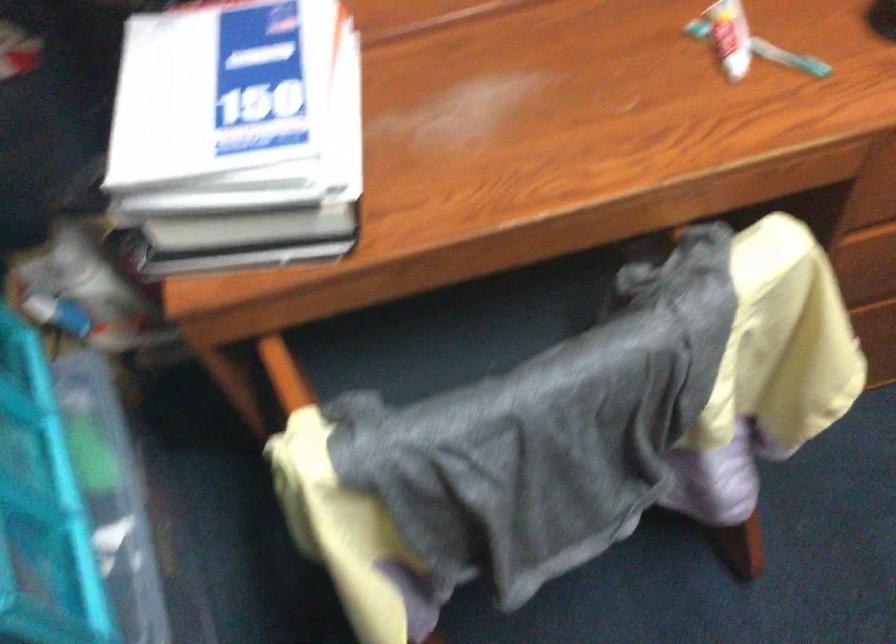
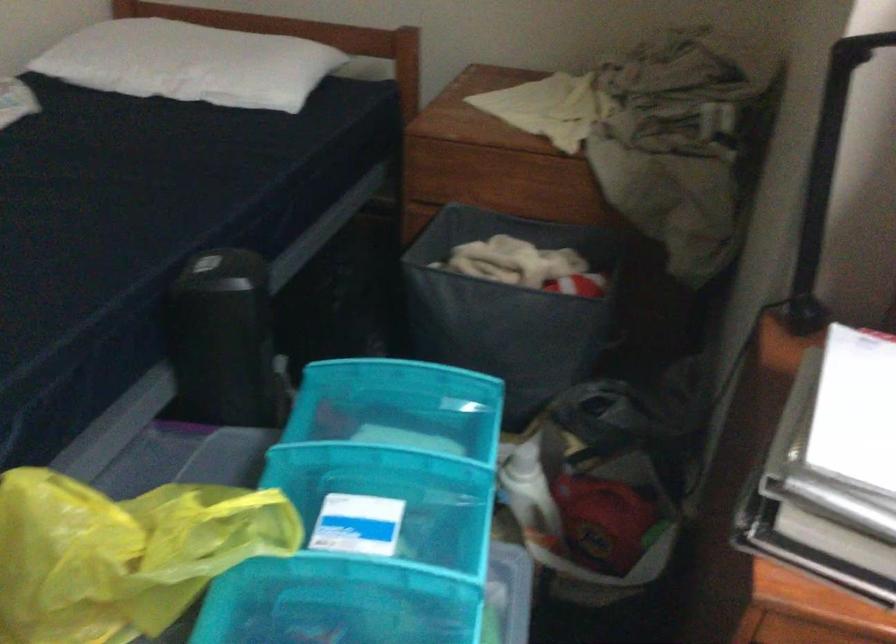
Question: Based on the continuous images, in which direction is the camera rotating? Reply with the corresponding letter.

Choices:
 (A) Left
 (B) Right
 (C) Up
 (D) Down

Answer: (A)